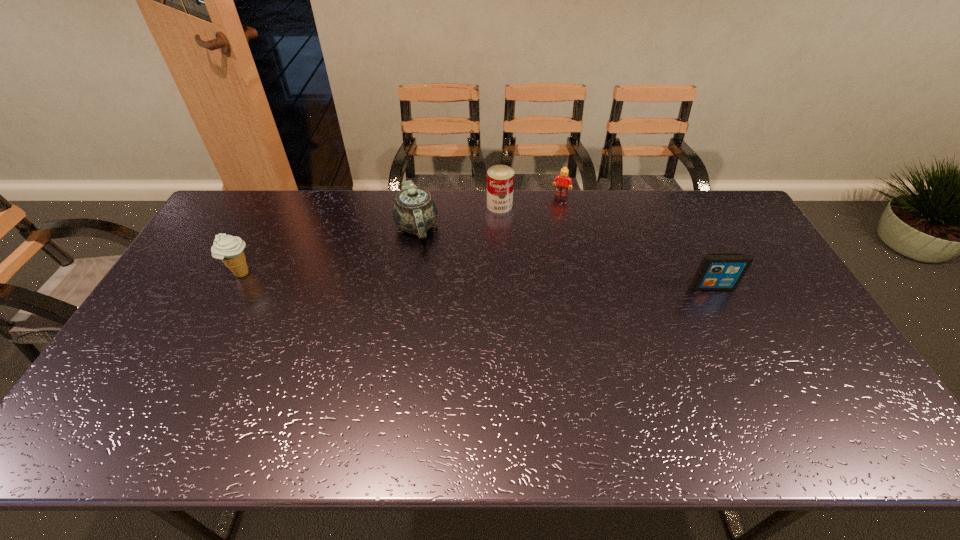
I want to click on vacant space located 0.350m from the spout of the fourth object from right to left, so click(x=393, y=336).

Identify the location of vacant region located 0.240m from the spout of the fourth object from right to left. (399, 306).

I want to click on vacant area situated 0.130m from the spout of the fourth object from right to left, so click(405, 279).

The width and height of the screenshot is (960, 540). I want to click on free space located 0.260m on the face of the second object from right to left, so click(541, 241).

You are a GUI agent. You are given a task and a screenshot of the screen. Output one action in this format:
    pyautogui.click(x=<x>, y=<y>)
    Task: Click on the free spot located on the face of the second object from right to left
    This screenshot has width=960, height=540.
    Given the screenshot: What is the action you would take?
    pyautogui.click(x=536, y=254)

At what (x,y) coordinates should I click in order to perform the action: click on free space located on the face of the second object from right to left. Please return your answer as a coordinate pair (x, y). The image size is (960, 540). Looking at the image, I should click on (538, 251).

You are a GUI agent. You are given a task and a screenshot of the screen. Output one action in this format:
    pyautogui.click(x=<x>, y=<y>)
    Task: Click on the can that is at the far edge
    Image resolution: width=960 pixels, height=540 pixels.
    Given the screenshot: What is the action you would take?
    click(x=500, y=178)

Locate an element on the screen. The width and height of the screenshot is (960, 540). chinaware that is at the far edge is located at coordinates (414, 211).

Locate an element on the screen. This screenshot has width=960, height=540. Lego situated at the far edge is located at coordinates (564, 182).

Where is `object located in the left edge section of the desktop`? object located in the left edge section of the desktop is located at coordinates (229, 249).